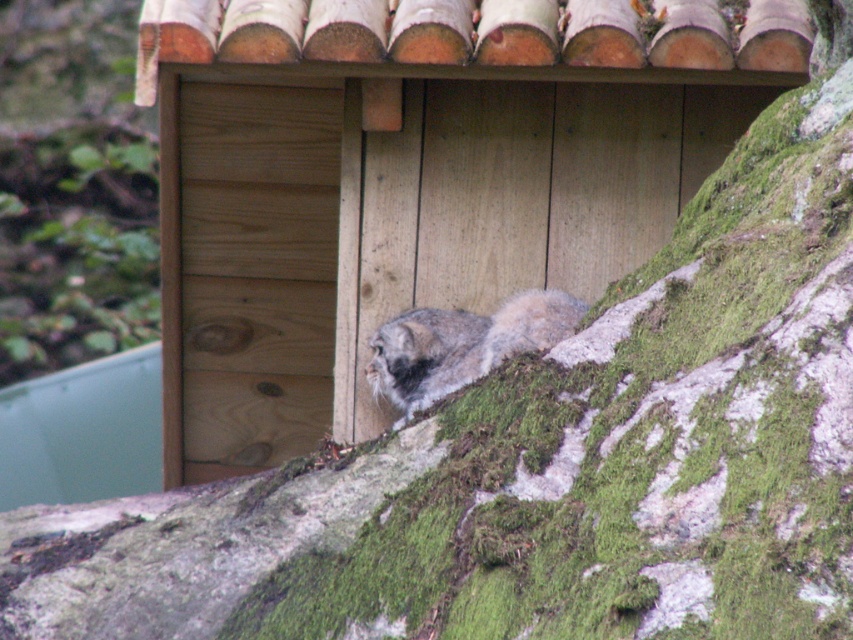
You are standing in a forest and see the wooden cabin at center and the fuzzy gray cat at center. Which object is closer to you?

The wooden cabin at center is closer to you because it is in front of the fuzzy gray cat at center.

You are standing at the camera position and want to reach the point at coordinates point (173, 188). If your walking speed is 1.2 meters per second, how long will it take you to reach that point?

The distance between point (173, 188) and the camera is 4.38 meters. At a walking speed of 1.2 meters per second, it would take approximately 3.65 seconds to reach the point.